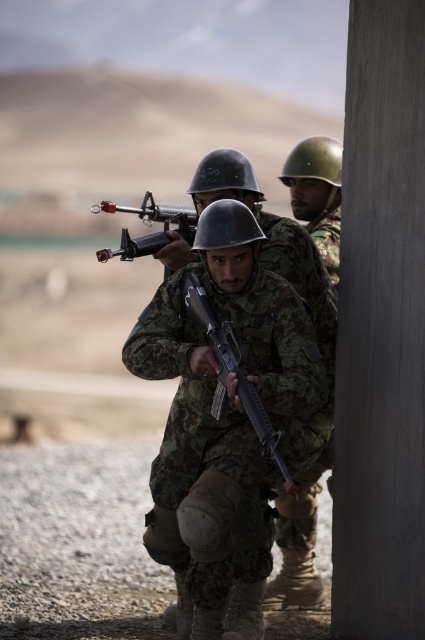
You are a soldier in the desert and need to choose a rifle that is easier to carry. The camouflage fabric rifle at center and the matte black rifle at center are available. Which one would you choose and why?

The matte black rifle at center is smaller in size compared to the camouflage fabric rifle at center, making it easier to carry.

You are a soldier in the desert needing to quickly grab the closest rifle to you. Which rifle should you choose between the camouflage fabric rifle at center and the matte black rifle at center?

The camouflage fabric rifle at center is closer to you since the matte black rifle at center is behind it.